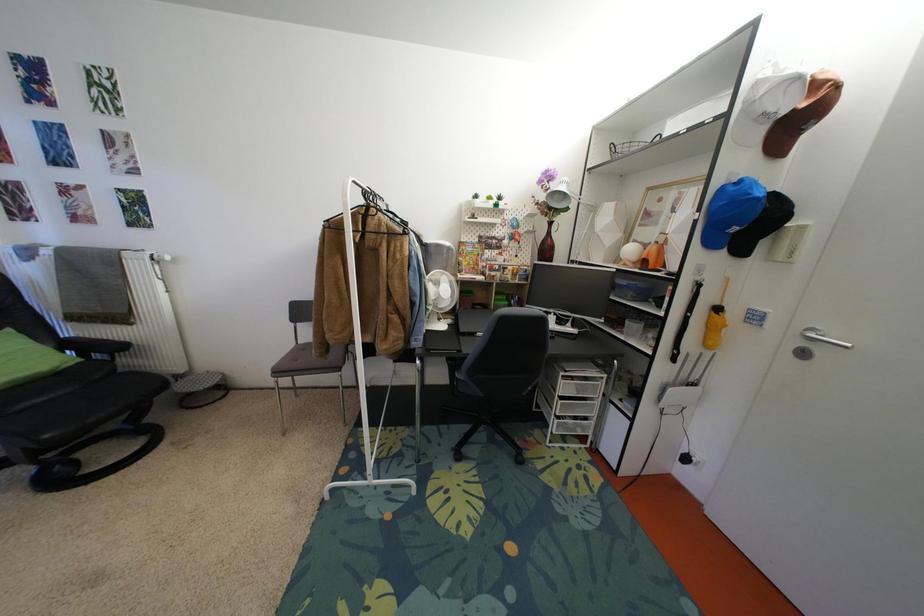
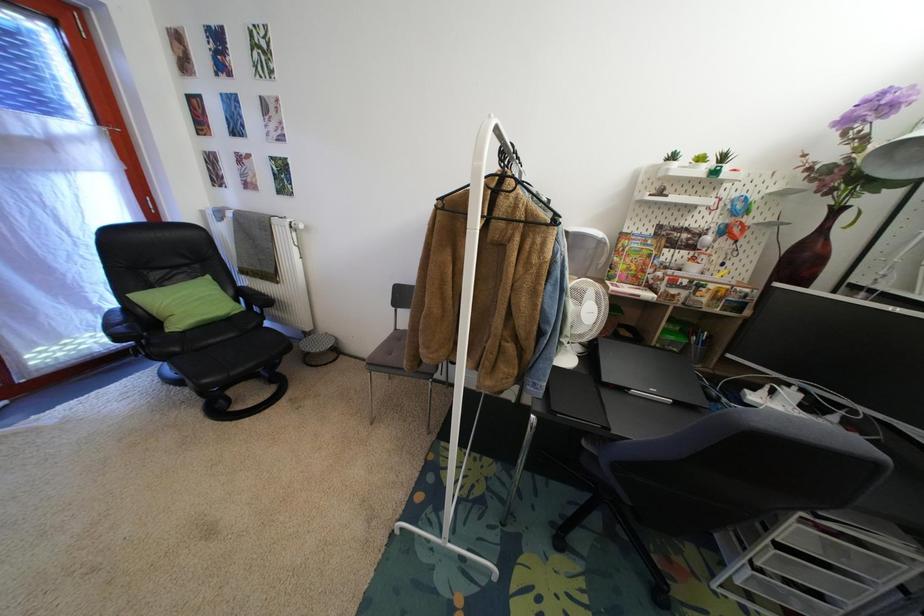
Question: The camera is either moving clockwise (left) or counter-clockwise (right) around the object. The first image is from the beginning of the video and the second image is from the end. Is the camera moving left or right when shooting the video?

Choices:
 (A) Left
 (B) Right

Answer: (B)